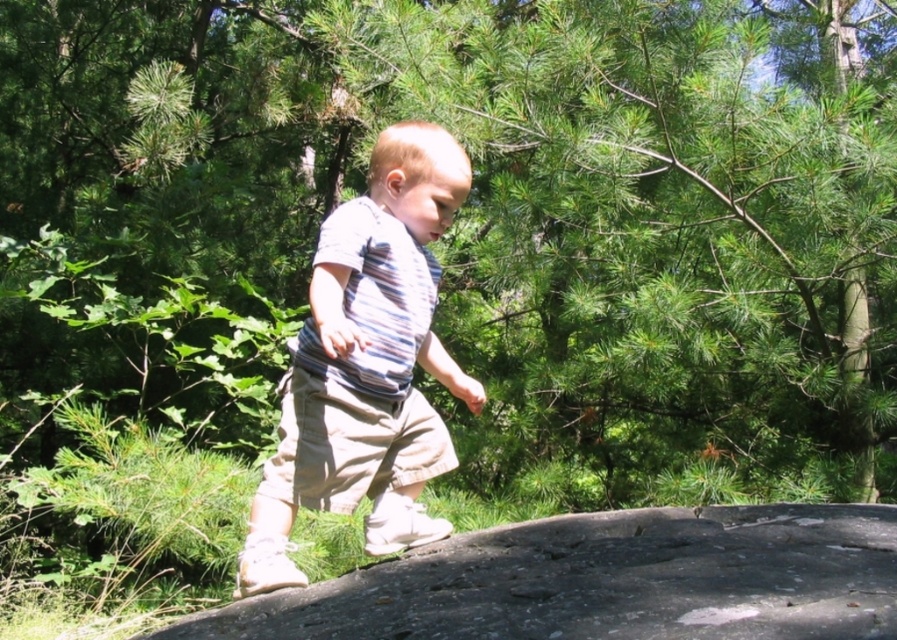
Consider the image. Can you confirm if smooth gray rock at center is wider than striped cotton shirt at center?

Yes, smooth gray rock at center is wider than striped cotton shirt at center.

The height and width of the screenshot is (640, 897). What do you see at coordinates (605, 580) in the screenshot?
I see `smooth gray rock at center` at bounding box center [605, 580].

The image size is (897, 640). In order to click on smooth gray rock at center in this screenshot , I will do `click(605, 580)`.